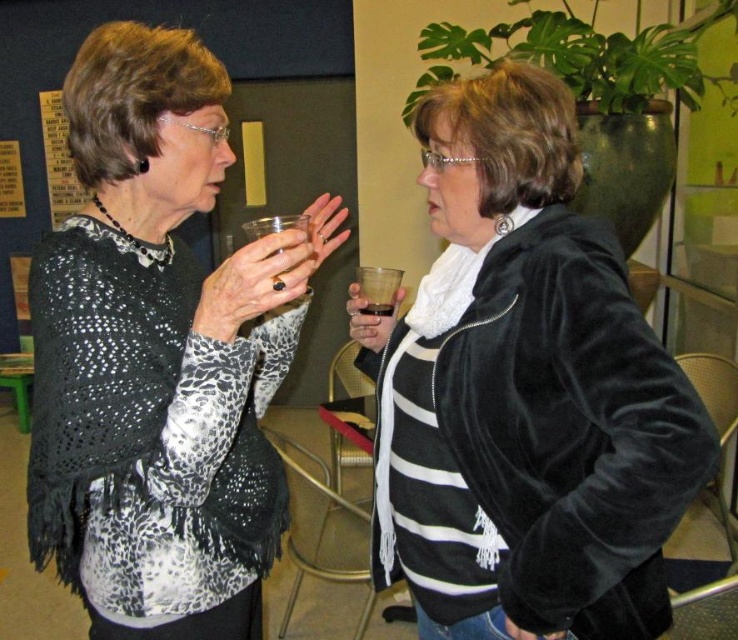
Question: Which of the following is the farthest from the observer?

Choices:
 (A) (176, 36)
 (B) (396, 276)
 (C) (294, 221)
 (D) (466, 90)

Answer: (B)

Question: Among these points, which one is farthest from the camera?

Choices:
 (A) (248, 221)
 (B) (92, 291)

Answer: (A)

Question: Is translucent plastic cup at center in front of transparent plastic cup at upper center?

Choices:
 (A) yes
 (B) no

Answer: (B)

Question: Which point is farther to the camera?

Choices:
 (A) (389, 307)
 (B) (382, 291)
 (C) (542, 516)
 (D) (283, 224)

Answer: (B)

Question: Does matte black sweater at center appear on the right side of dark red glass at center?

Choices:
 (A) yes
 (B) no

Answer: (B)

Question: Does matte black sweater at center have a lesser width compared to dark red glass at center?

Choices:
 (A) no
 (B) yes

Answer: (A)